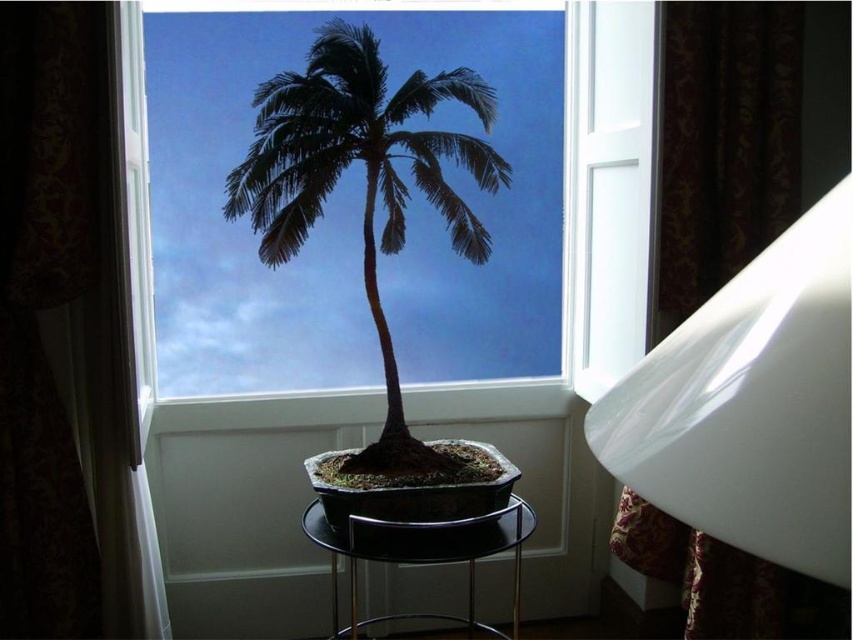
Question: Which of the following is the farthest from the observer?

Choices:
 (A) black glass stool at center
 (B) dull brown soil at center

Answer: (B)

Question: Estimate the real-world distances between objects in this image. Which object is farther from the dull brown soil at center?

Choices:
 (A) black glass stool at center
 (B) silky black palm tree at center

Answer: (B)

Question: Does silky black palm tree at center appear under dull brown soil at center?

Choices:
 (A) no
 (B) yes

Answer: (A)

Question: Estimate the real-world distances between objects in this image. Which object is farther from the black glass stool at center?

Choices:
 (A) dull brown soil at center
 (B) silky black palm tree at center

Answer: (B)

Question: Does silky black palm tree at center have a larger size compared to dull brown soil at center?

Choices:
 (A) no
 (B) yes

Answer: (B)

Question: Is silky black palm tree at center below dull brown soil at center?

Choices:
 (A) yes
 (B) no

Answer: (B)